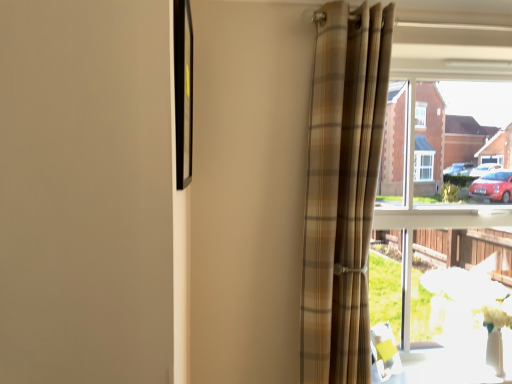
The width and height of the screenshot is (512, 384). What do you see at coordinates (445, 368) in the screenshot?
I see `white glossy table at lower right` at bounding box center [445, 368].

Identify the location of white glossy table at lower right. The width and height of the screenshot is (512, 384). (445, 368).

You are a GUI agent. You are given a task and a screenshot of the screen. Output one action in this format:
    pyautogui.click(x=<x>, y=<y>)
    Task: Click on the plaid fabric curtain at right
    The width and height of the screenshot is (512, 384).
    Given the screenshot: What is the action you would take?
    pyautogui.click(x=342, y=188)

Describe the element at coordinates (342, 188) in the screenshot. I see `plaid fabric curtain at right` at that location.

The width and height of the screenshot is (512, 384). I want to click on white glossy table at lower right, so click(445, 368).

Does clear glass window at right have a lesser width compared to plaid fabric curtain at right?

Yes, clear glass window at right is thinner than plaid fabric curtain at right.

From a real-world perspective, is clear glass window at right on top of plaid fabric curtain at right?

Actually, clear glass window at right is physically below plaid fabric curtain at right in the real world.

From their relative heights in the image, would you say clear glass window at right is taller or shorter than plaid fabric curtain at right?

clear glass window at right is shorter than plaid fabric curtain at right.

Based on their positions, is clear glass window at right located to the left or right of plaid fabric curtain at right?

clear glass window at right is positioned on plaid fabric curtain at right's right side.

Are clear glass window at right and black glossy picture frame at upper left making contact?

No.

In terms of width, does clear glass window at right look wider or thinner when compared to black glossy picture frame at upper left?

Considering their sizes, clear glass window at right looks broader than black glossy picture frame at upper left.

From the image's perspective, is clear glass window at right on top of black glossy picture frame at upper left?

No, from the image's perspective, clear glass window at right is not over black glossy picture frame at upper left.

Is clear glass window at right spatially inside black glossy picture frame at upper left, or outside of it?

clear glass window at right is outside black glossy picture frame at upper left.

From the image's perspective, who appears lower, white glossy table at lower right or plaid fabric curtain at right?

white glossy table at lower right is shown below in the image.

Choose the correct answer: Is white glossy table at lower right inside plaid fabric curtain at right or outside it?

white glossy table at lower right is not inside plaid fabric curtain at right, it's outside.

Is the position of white glossy table at lower right more distant than that of plaid fabric curtain at right?

Yes, white glossy table at lower right is further from the viewer.

Between black glossy picture frame at upper left and clear glass window at right, which one has smaller size?

Smaller between the two is black glossy picture frame at upper left.

Which object is positioned more to the right, black glossy picture frame at upper left or clear glass window at right?

Positioned to the right is clear glass window at right.

Considering the positions of points (189, 89) and (411, 291), is point (189, 89) closer to camera compared to point (411, 291)?

Yes, point (189, 89) is closer to viewer.

How different are the orientations of black glossy picture frame at upper left and clear glass window at right in degrees?

89.9 degrees separate the facing orientations of black glossy picture frame at upper left and clear glass window at right.

In the scene shown: Could you tell me if white glossy table at lower right is turned towards black glossy picture frame at upper left?

No, white glossy table at lower right is not turned towards black glossy picture frame at upper left.

Can black glossy picture frame at upper left be found inside white glossy table at lower right?

No.

Which object is closer to the camera, white glossy table at lower right or black glossy picture frame at upper left?

black glossy picture frame at upper left is more forward.

Consider the image. From the image's perspective, would you say black glossy picture frame at upper left is positioned over white glossy table at lower right?

Correct, black glossy picture frame at upper left appears higher than white glossy table at lower right in the image.

How many degrees apart are the facing directions of black glossy picture frame at upper left and white glossy table at lower right?

There is a 90-degree angle between the facing directions of black glossy picture frame at upper left and white glossy table at lower right.

Is black glossy picture frame at upper left positioned far away from white glossy table at lower right?

Absolutely, black glossy picture frame at upper left is distant from white glossy table at lower right.

Is black glossy picture frame at upper left bigger than white glossy table at lower right?

Correct, black glossy picture frame at upper left is larger in size than white glossy table at lower right.

You are a GUI agent. You are given a task and a screenshot of the screen. Output one action in this format:
    pyautogui.click(x=<x>, y=<y>)
    Task: Click on the table directly beneath the clear glass window at right (from a real-world perspective)
    Image resolution: width=512 pixels, height=384 pixels.
    Given the screenshot: What is the action you would take?
    445,368

Which is correct: clear glass window at right is inside white glossy table at lower right, or outside of it?

clear glass window at right is located beyond the bounds of white glossy table at lower right.

Does point (414, 369) appear closer or farther from the camera than point (418, 381)?

Point (414, 369).

Identify the location of window located underneath the plaid fabric curtain at right (from a real-world perspective). (447, 285).

Where is `picture frame in front of the clear glass window at right`? picture frame in front of the clear glass window at right is located at coordinates (183, 91).

Which object lies further to the anchor point clear glass window at right, black glossy picture frame at upper left or plaid fabric curtain at right?

The object further to clear glass window at right is black glossy picture frame at upper left.

When comparing their distances from plaid fabric curtain at right, does white glossy table at lower right or clear glass window at right seem further?

The object further to plaid fabric curtain at right is white glossy table at lower right.

From the image, which object appears to be farther from white glossy table at lower right, plaid fabric curtain at right or black glossy picture frame at upper left?

The object further to white glossy table at lower right is black glossy picture frame at upper left.

When comparing their distances from white glossy table at lower right, does black glossy picture frame at upper left or clear glass window at right seem further?

black glossy picture frame at upper left is positioned further to the anchor white glossy table at lower right.

Based on their spatial positions, is black glossy picture frame at upper left or clear glass window at right closer to plaid fabric curtain at right?

clear glass window at right is positioned closer to the anchor plaid fabric curtain at right.

Considering their positions, is clear glass window at right positioned closer to black glossy picture frame at upper left than white glossy table at lower right?

clear glass window at right is closer to black glossy picture frame at upper left.

Looking at the image, which one is located closer to clear glass window at right, plaid fabric curtain at right or black glossy picture frame at upper left?

The object closer to clear glass window at right is plaid fabric curtain at right.

Looking at the image, which one is located further to plaid fabric curtain at right, white glossy table at lower right or black glossy picture frame at upper left?

white glossy table at lower right is further to plaid fabric curtain at right.

This screenshot has height=384, width=512. I want to click on window between plaid fabric curtain at right and white glossy table at lower right in the up-down direction, so click(447, 285).

Find the location of `curtain situated between black glossy picture frame at upper left and clear glass window at right from left to right`. curtain situated between black glossy picture frame at upper left and clear glass window at right from left to right is located at coordinates (342, 188).

Locate an element on the screen. Image resolution: width=512 pixels, height=384 pixels. table between black glossy picture frame at upper left and clear glass window at right from left to right is located at coordinates (445, 368).

Identify the location of curtain between black glossy picture frame at upper left and white glossy table at lower right in the vertical direction. The image size is (512, 384). (342, 188).